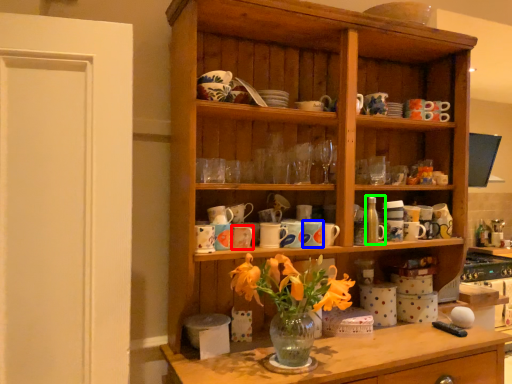
Question: Estimate the real-world distances between objects in this image. Which object is farther from tableware (highlighted by a red box), tableware (highlighted by a blue box) or bottle (highlighted by a green box)?

Choices:
 (A) tableware
 (B) bottle

Answer: (B)